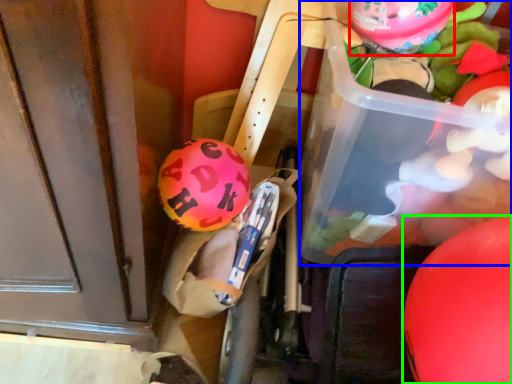
Question: Based on their relative distances, which object is farther from balloon (highlighted by a red box)? Choose from wide (highlighted by a blue box) and balloon (highlighted by a green box).

Choices:
 (A) wide
 (B) balloon

Answer: (B)